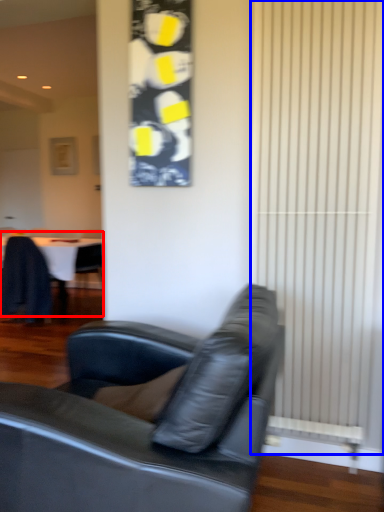
Question: Which of the following is the farthest to the observer, table (highlighted by a red box) or curtain (highlighted by a blue box)?

Choices:
 (A) table
 (B) curtain

Answer: (A)